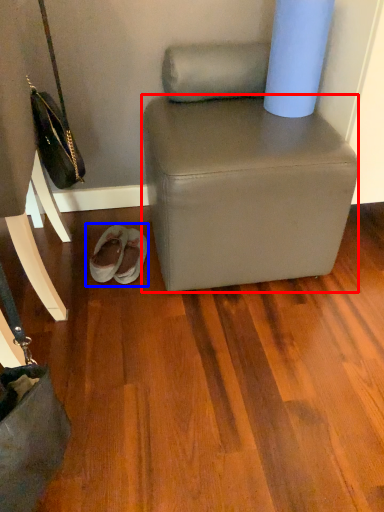
Question: Which of the following is the farthest to the observer, stool (highlighted by a red box) or footwear (highlighted by a blue box)?

Choices:
 (A) stool
 (B) footwear

Answer: (B)